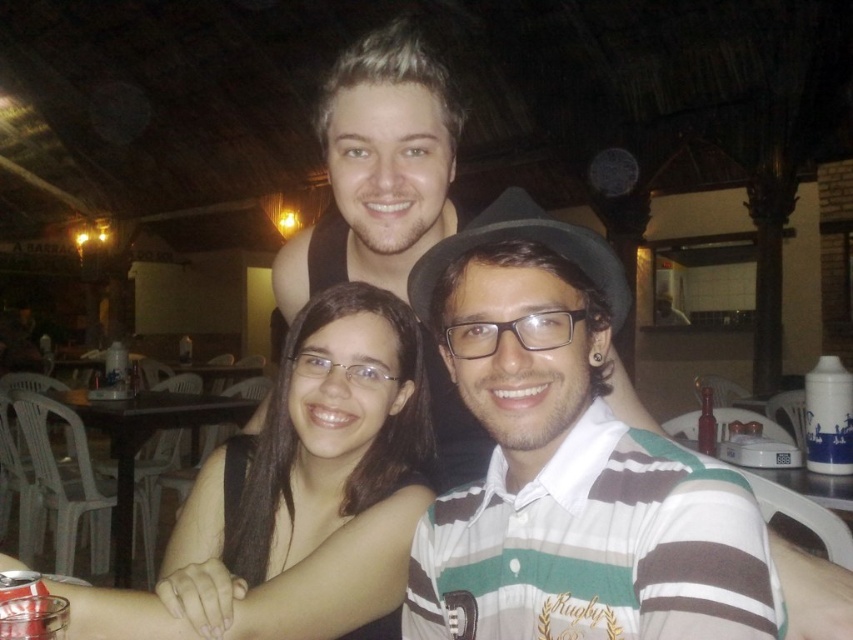
Question: Which point is closer to the camera?

Choices:
 (A) black matte hair at center
 (B) striped cotton shirt at center

Answer: (B)

Question: In this image, where is black matte hair at center located relative to black plastic table at lower left?

Choices:
 (A) left
 (B) right

Answer: (B)

Question: Is black matte hair at center below black plastic table at lower left?

Choices:
 (A) yes
 (B) no

Answer: (B)

Question: Which point is farther from the camera taking this photo?

Choices:
 (A) (563, 557)
 (B) (109, 429)

Answer: (B)

Question: Observing the image, what is the correct spatial positioning of striped cotton shirt at center in reference to black matte hair at center?

Choices:
 (A) above
 (B) below

Answer: (A)

Question: Based on their relative distances, which object is nearer to the black matte hair at center?

Choices:
 (A) striped cotton shirt at center
 (B) black plastic table at lower left

Answer: (A)